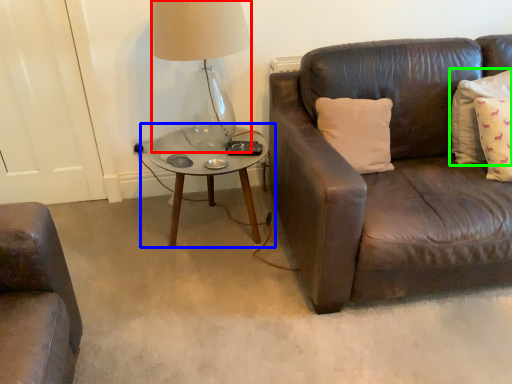
Question: Estimate the real-world distances between objects in this image. Which object is closer to table lamp (highlighted by a red box), coffee table (highlighted by a blue box) or pillow (highlighted by a green box)?

Choices:
 (A) coffee table
 (B) pillow

Answer: (A)